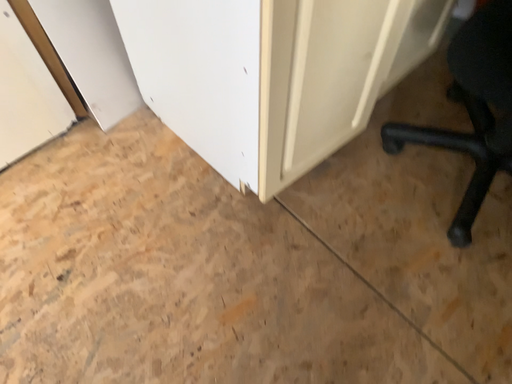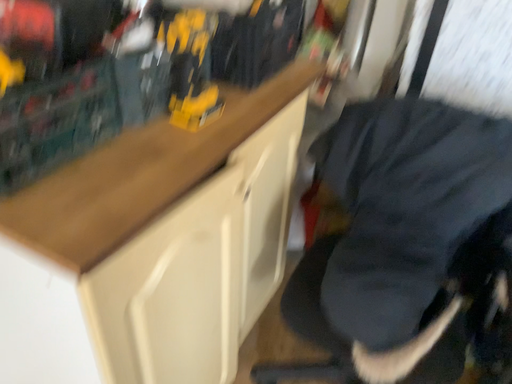
Question: How did the camera likely rotate when shooting the video?

Choices:
 (A) rotated right
 (B) rotated left

Answer: (A)